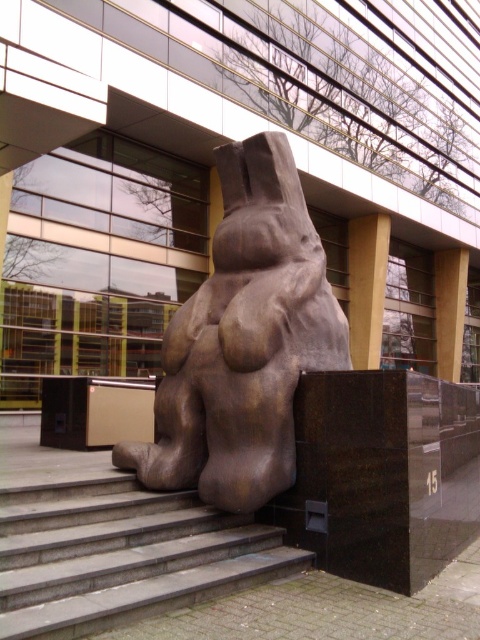
Question: Can you confirm if bronze sculpture at center is bigger than smooth concrete stairs at center?

Choices:
 (A) yes
 (B) no

Answer: (A)

Question: Is bronze sculpture at center to the right of smooth concrete stairs at center from the viewer's perspective?

Choices:
 (A) no
 (B) yes

Answer: (B)

Question: Considering the relative positions of bronze sculpture at center and smooth concrete stairs at center in the image provided, where is bronze sculpture at center located with respect to smooth concrete stairs at center?

Choices:
 (A) left
 (B) right

Answer: (B)

Question: Which of the following is the closest to the observer?

Choices:
 (A) smooth concrete stairs at center
 (B) bronze sculpture at center

Answer: (A)

Question: Which point is farther to the camera?

Choices:
 (A) click(245, 486)
 (B) click(179, 536)

Answer: (A)